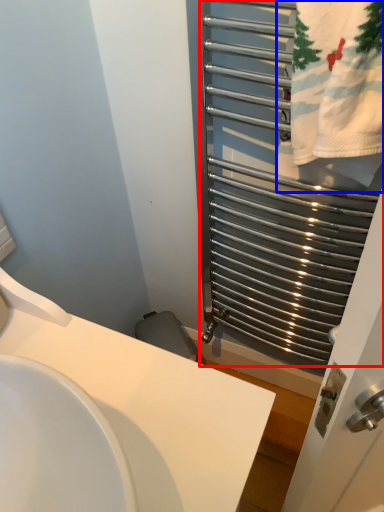
Question: Which of the following is the closest to the observer, cage (highlighted by a red box) or bath towel (highlighted by a blue box)?

Choices:
 (A) cage
 (B) bath towel

Answer: (A)